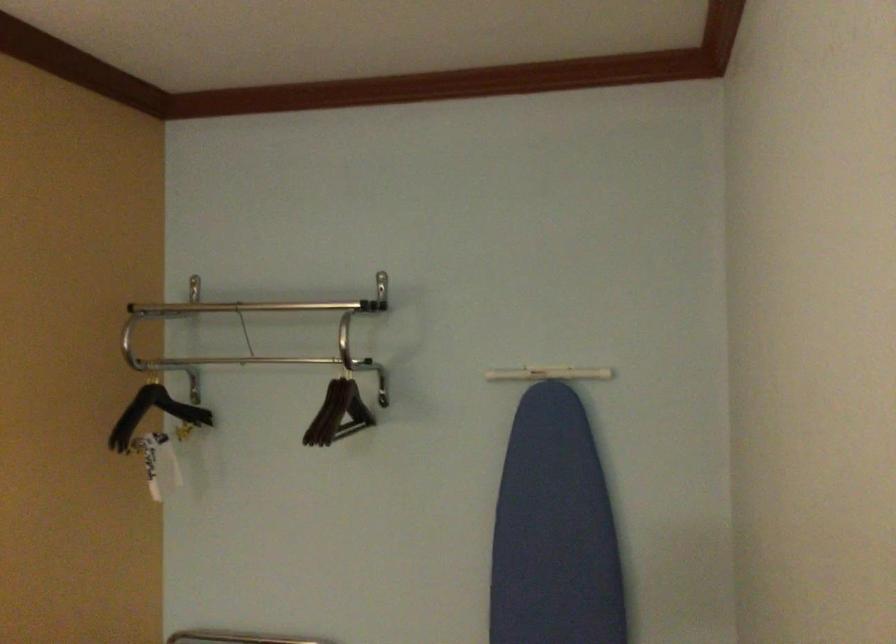
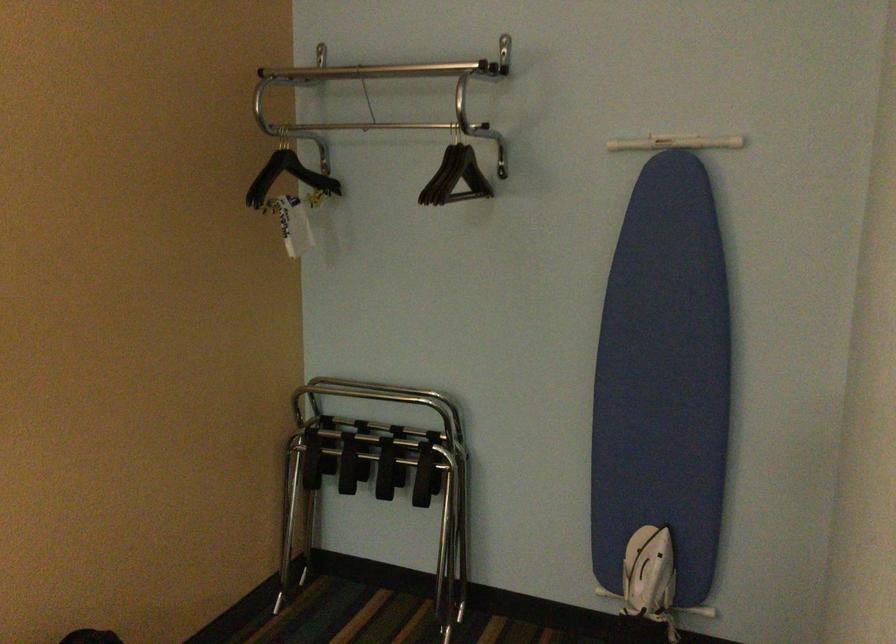
Where in the second image is the point corresponding to point (161, 462) from the first image?

(291, 223)